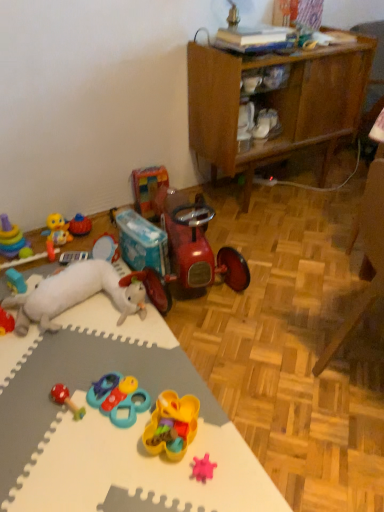
You are a GUI agent. You are given a task and a screenshot of the screen. Output one action in this format:
    pyautogui.click(x=<x>, y=<y>)
    Task: Click on the vacant region in front of rubber teething ring at lower left, the 3th toy in the left-to-right sequence
    This screenshot has width=384, height=512.
    Given the screenshot: What is the action you would take?
    pyautogui.click(x=15, y=317)